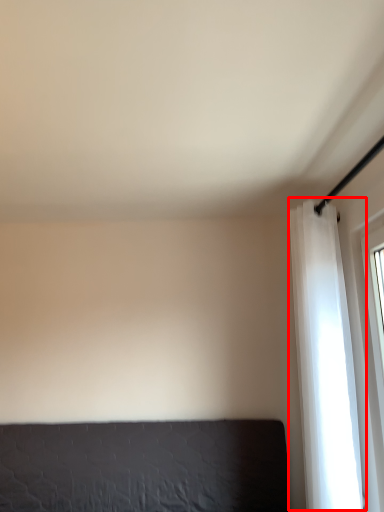
Question: From the image's perspective, what is the correct spatial relationship of curtain (annotated by the red box) in relation to furniture?

Choices:
 (A) above
 (B) below

Answer: (A)